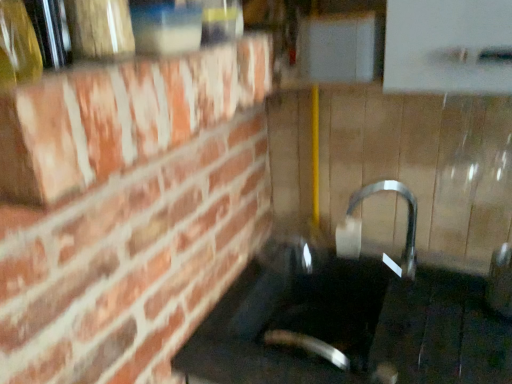
This screenshot has height=384, width=512. In order to click on translucent glass bottle at upper left in this screenshot , I will do (17, 45).

Measure the distance between point [318,354] and camera.

1.11 meters.

Where is `translucent glass bottle at upper left`? translucent glass bottle at upper left is located at coordinates [17, 45].

From the image's perspective, is satin nickel faucet at center on top of translucent glass bottle at upper left?

No.

Considering the relative sizes of satin nickel faucet at center and translucent glass bottle at upper left in the image provided, is satin nickel faucet at center shorter than translucent glass bottle at upper left?

In fact, satin nickel faucet at center may be taller than translucent glass bottle at upper left.

Consider the image. Based on their sizes in the image, would you say satin nickel faucet at center is bigger or smaller than translucent glass bottle at upper left?

In the image, satin nickel faucet at center appears to be larger than translucent glass bottle at upper left.

Can translucent glass bottle at upper left be found inside satin nickel faucet at center?

No, translucent glass bottle at upper left is not inside satin nickel faucet at center.

Considering the relative sizes of satin nickel faucet at center and black glass sink at center in the image provided, is satin nickel faucet at center thinner than black glass sink at center?

Yes, satin nickel faucet at center is thinner than black glass sink at center.

What's the angular difference between satin nickel faucet at center and black glass sink at center's facing directions?

0.47 degrees separate the facing orientations of satin nickel faucet at center and black glass sink at center.

In the image, is satin nickel faucet at center positioned in front of or behind black glass sink at center?

In the image, satin nickel faucet at center appears behind black glass sink at center.

Considering the relative positions of satin nickel faucet at center and black glass sink at center in the image provided, is satin nickel faucet at center to the right of black glass sink at center from the viewer's perspective?

Yes, satin nickel faucet at center is to the right of black glass sink at center.

How distant is translucent glass bottle at upper left from black glass sink at center?

translucent glass bottle at upper left and black glass sink at center are 35.60 inches apart.

In terms of width, does translucent glass bottle at upper left look wider or thinner when compared to black glass sink at center?

translucent glass bottle at upper left is thinner than black glass sink at center.

From a real-world perspective, who is located higher, translucent glass bottle at upper left or black glass sink at center?

translucent glass bottle at upper left, from a real-world perspective.

From the image's perspective, which is above, translucent glass bottle at upper left or black glass sink at center?

From the image's view, translucent glass bottle at upper left is above.

Which object is thinner, translucent glass bottle at upper left or satin nickel faucet at center?

Thinner between the two is translucent glass bottle at upper left.

Locate an element on the screen. The image size is (512, 384). bottle on the left of the satin nickel faucet at center is located at coordinates (17, 45).

Can we say translucent glass bottle at upper left lies outside satin nickel faucet at center?

Yes, translucent glass bottle at upper left is located beyond the bounds of satin nickel faucet at center.

Which is more to the right, translucent glass bottle at upper left or satin nickel faucet at center?

satin nickel faucet at center is more to the right.

Is point (232, 336) positioned behind point (19, 46)?

Yes, it is.

In the image, is black glass sink at center positioned in front of or behind translucent glass bottle at upper left?

black glass sink at center is behind translucent glass bottle at upper left.

Is translucent glass bottle at upper left at the back of black glass sink at center?

No.

Which object is positioned more to the right, black glass sink at center or translucent glass bottle at upper left?

From the viewer's perspective, black glass sink at center appears more on the right side.

Does black glass sink at center turn towards satin nickel faucet at center?

No, black glass sink at center is not turned towards satin nickel faucet at center.

Which object is positioned more to the left, black glass sink at center or satin nickel faucet at center?

From the viewer's perspective, black glass sink at center appears more on the left side.

The height and width of the screenshot is (384, 512). In the image, there is a translucent glass bottle at upper left. In order to click on faucet below it (from the image's perspective) in this screenshot , I will do `click(361, 227)`.

Locate an element on the screen. The width and height of the screenshot is (512, 384). counter top that is under the satin nickel faucet at center (from a real-world perspective) is located at coordinates (352, 328).

Which object lies nearer to the anchor point satin nickel faucet at center, translucent glass bottle at upper left or black glass sink at center?

The object closer to satin nickel faucet at center is black glass sink at center.

Based on their spatial positions, is satin nickel faucet at center or translucent glass bottle at upper left closer to black glass sink at center?

satin nickel faucet at center is positioned closer to the anchor black glass sink at center.

When comparing their distances from translucent glass bottle at upper left, does satin nickel faucet at center or black glass sink at center seem closer?

Based on the image, black glass sink at center appears to be nearer to translucent glass bottle at upper left.

Considering their positions, is black glass sink at center positioned further to translucent glass bottle at upper left than satin nickel faucet at center?

satin nickel faucet at center is positioned further to the anchor translucent glass bottle at upper left.

Looking at this image, when comparing their distances from satin nickel faucet at center, does black glass sink at center or translucent glass bottle at upper left seem closer?

The object closer to satin nickel faucet at center is black glass sink at center.

From the image, which object appears to be nearer to black glass sink at center, translucent glass bottle at upper left or satin nickel faucet at center?

The object closer to black glass sink at center is satin nickel faucet at center.

Locate an element on the screen. The height and width of the screenshot is (384, 512). faucet between translucent glass bottle at upper left and black glass sink at center in the vertical direction is located at coordinates (361, 227).